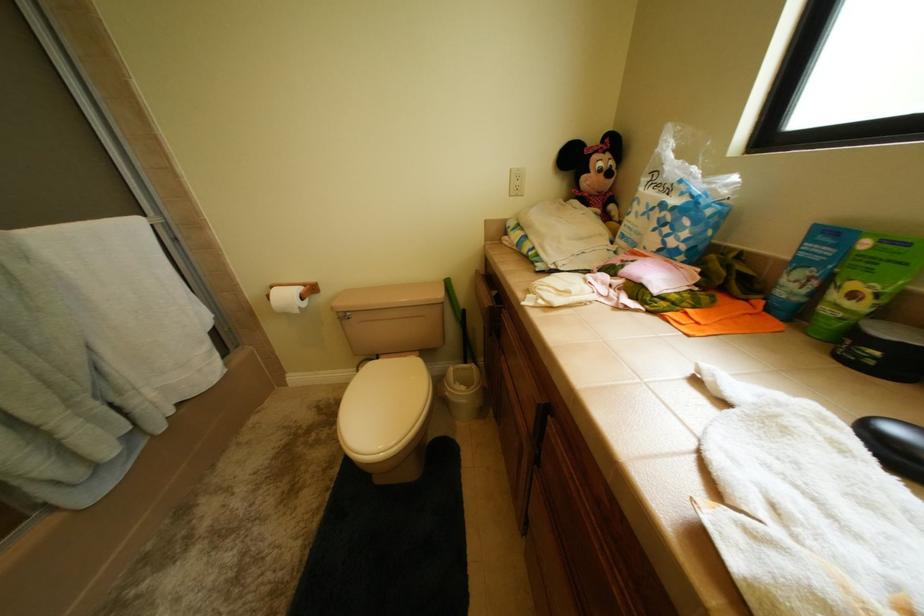
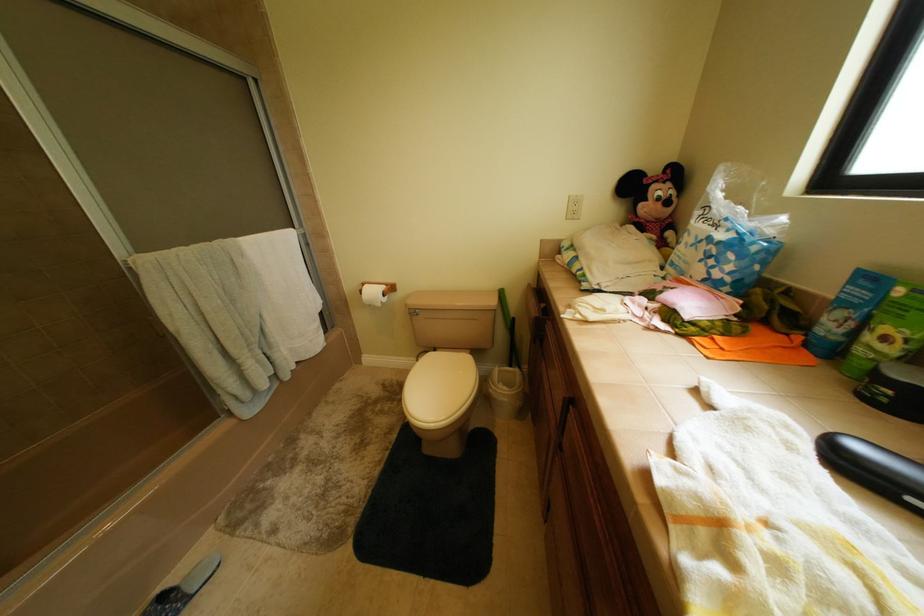
Question: What movement of the cameraman would produce the second image?

Choices:
 (A) Left
 (B) Right
 (C) Forward
 (D) Backward

Answer: (D)